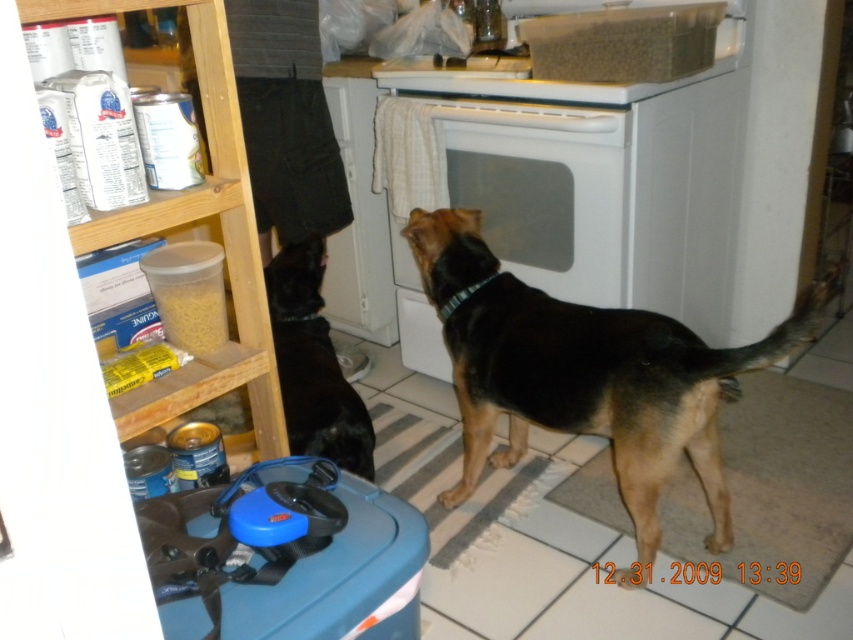
Question: Which object appears farthest from the camera in this image?

Choices:
 (A) brown fur dog at center
 (B) black fur dog at center
 (C) white matte oven at center

Answer: (C)

Question: Which point is closer to the camera?

Choices:
 (A) brown fur dog at center
 (B) white matte oven at center
 (C) black fur dog at center

Answer: (A)

Question: Where is white matte oven at center located in relation to black fur dog at center in the image?

Choices:
 (A) right
 (B) left

Answer: (A)

Question: Which object is farther from the camera taking this photo?

Choices:
 (A) brown fur dog at center
 (B) white matte oven at center

Answer: (B)

Question: Can you confirm if white matte oven at center is positioned below black fur dog at center?

Choices:
 (A) yes
 (B) no

Answer: (B)

Question: Is brown fur dog at center wider than black fur dog at center?

Choices:
 (A) no
 (B) yes

Answer: (B)